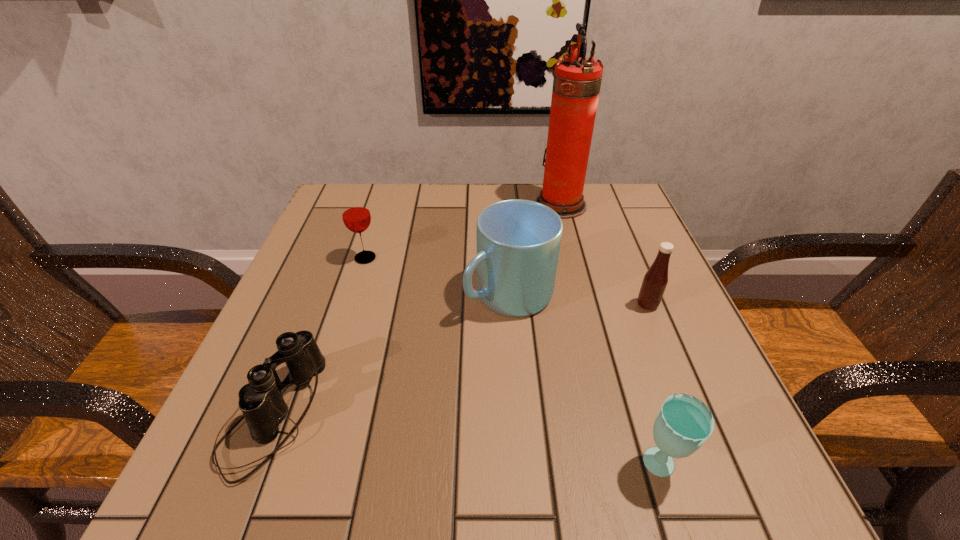
The image size is (960, 540). I want to click on binoculars present at the left edge, so (261, 402).

Where is `fire extinguisher at the right edge`? Image resolution: width=960 pixels, height=540 pixels. fire extinguisher at the right edge is located at coordinates (576, 85).

This screenshot has height=540, width=960. In order to click on Tabasco sauce that is at the right edge in this screenshot , I will do `click(655, 280)`.

At what (x,y) coordinates should I click in order to perform the action: click on glass located at the right edge. Please return your answer as a coordinate pair (x, y). The width and height of the screenshot is (960, 540). Looking at the image, I should click on pos(684,423).

This screenshot has width=960, height=540. What are the coordinates of `object that is positioned at the near left corner` in the screenshot? It's located at (261, 402).

The image size is (960, 540). Find the location of `object that is at the far right corner`. object that is at the far right corner is located at coordinates (576, 85).

Locate an element on the screen. object situated at the near right corner is located at coordinates (684, 423).

In the image, there is a desktop. At what (x,y) coordinates should I click in order to perform the action: click on vacant space at the near edge. Please return your answer as a coordinate pair (x, y). The image size is (960, 540). Looking at the image, I should click on (372, 447).

Image resolution: width=960 pixels, height=540 pixels. What are the coordinates of `free spot at the left edge of the desktop` in the screenshot? It's located at tap(332, 308).

In the image, there is a desktop. Find the location of `free space at the right edge`. free space at the right edge is located at coordinates (708, 365).